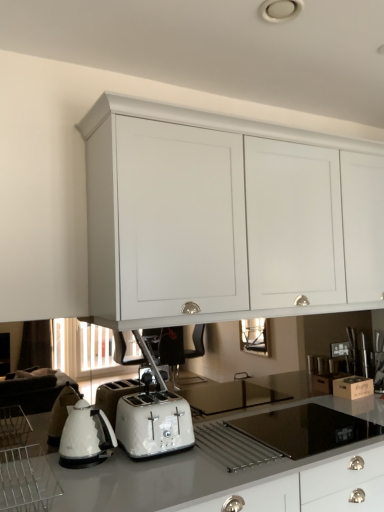
Question: Considering the relative sizes of white glossy kettle at lower left and white matte cabinet at upper center in the image provided, is white glossy kettle at lower left wider than white matte cabinet at upper center?

Choices:
 (A) no
 (B) yes

Answer: (A)

Question: Is white glossy kettle at lower left oriented towards white matte cabinet at upper center?

Choices:
 (A) no
 (B) yes

Answer: (A)

Question: From a real-world perspective, does white glossy kettle at lower left sit lower than white matte cabinet at upper center?

Choices:
 (A) no
 (B) yes

Answer: (B)

Question: Is white glossy kettle at lower left shorter than white matte cabinet at upper center?

Choices:
 (A) no
 (B) yes

Answer: (B)

Question: From the image's perspective, is white glossy kettle at lower left beneath white matte cabinet at upper center?

Choices:
 (A) yes
 (B) no

Answer: (A)

Question: In terms of width, does white glossy countertop at lower center look wider or thinner when compared to white matte cabinet at upper center?

Choices:
 (A) thin
 (B) wide

Answer: (B)

Question: From the image's perspective, is white glossy countertop at lower center located above or below white matte cabinet at upper center?

Choices:
 (A) above
 (B) below

Answer: (B)

Question: From a real-world perspective, is white glossy countertop at lower center positioned above or below white matte cabinet at upper center?

Choices:
 (A) below
 (B) above

Answer: (A)

Question: Considering their positions, is white glossy countertop at lower center located in front of or behind white matte cabinet at upper center?

Choices:
 (A) front
 (B) behind

Answer: (A)

Question: Would you say white glossy countertop at lower center is to the left or to the right of white glossy toaster at lower center in the picture?

Choices:
 (A) left
 (B) right

Answer: (B)

Question: Relative to white glossy toaster at lower center, is white glossy countertop at lower center in front or behind?

Choices:
 (A) front
 (B) behind

Answer: (A)

Question: Would you say white glossy countertop at lower center is inside or outside white glossy toaster at lower center?

Choices:
 (A) inside
 (B) outside

Answer: (B)

Question: Is white glossy countertop at lower center bigger or smaller than white glossy toaster at lower center?

Choices:
 (A) small
 (B) big

Answer: (B)

Question: Is white glossy toaster at lower center in front of or behind clear plastic rack at lower left in the image?

Choices:
 (A) behind
 (B) front

Answer: (A)

Question: Would you say white glossy toaster at lower center is to the left or to the right of clear plastic rack at lower left in the picture?

Choices:
 (A) left
 (B) right

Answer: (B)